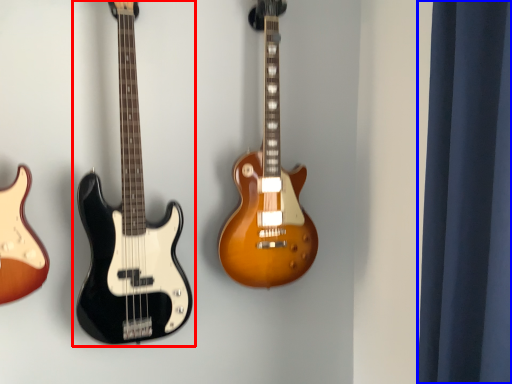
Question: Which object is further to the camera taking this photo, guitar (highlighted by a red box) or curtain (highlighted by a blue box)?

Choices:
 (A) guitar
 (B) curtain

Answer: (A)